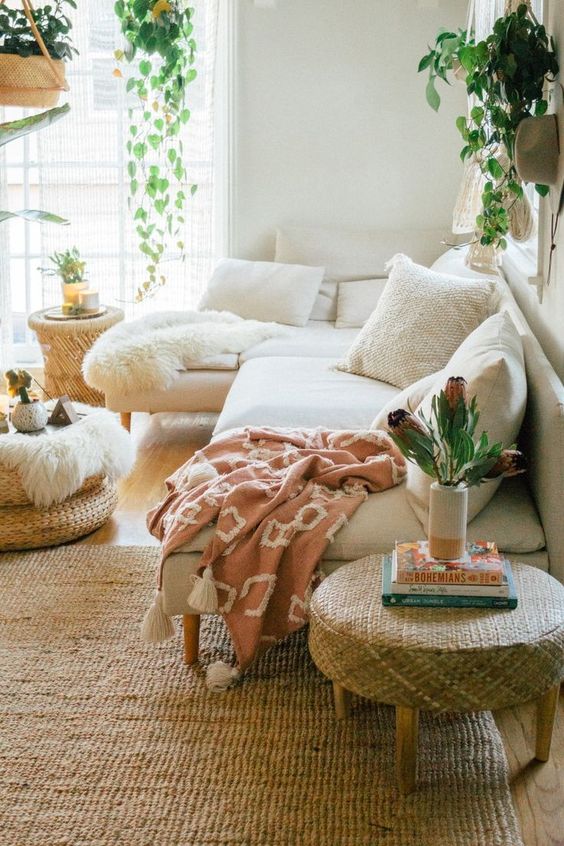
At what (x,y) coordinates should I click in order to perform the action: click on plant. Please return your answer as a coordinate pair (x, y). The width and height of the screenshot is (564, 846). Looking at the image, I should click on (449, 507), (444, 475), (423, 453), (431, 420), (467, 463).